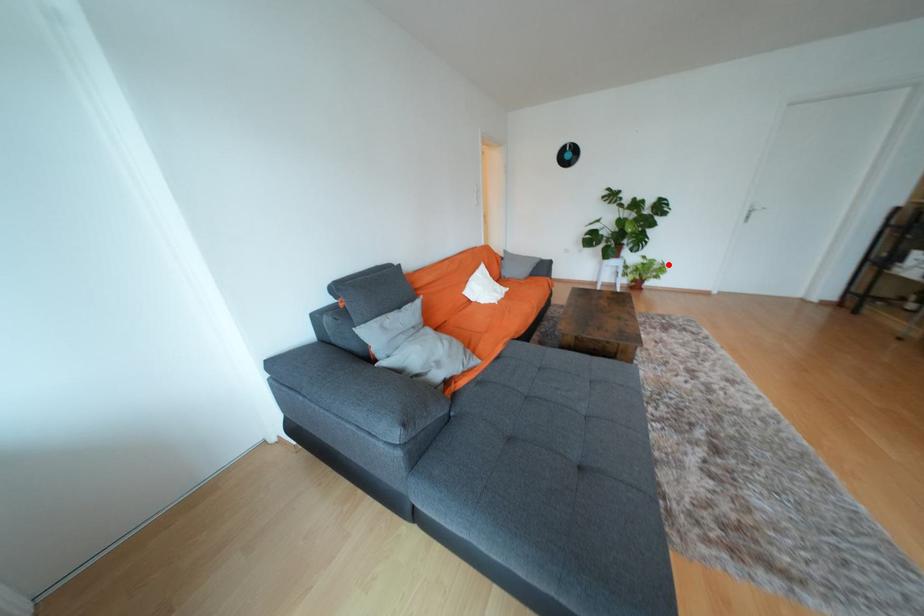
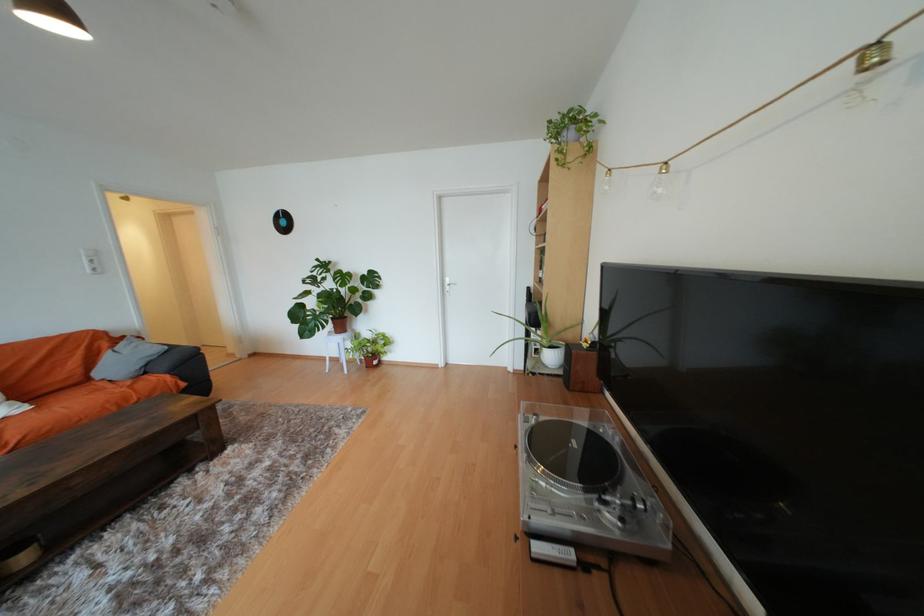
Where in the second image is the point corresponding to the highlighted location from the first image?

(391, 339)